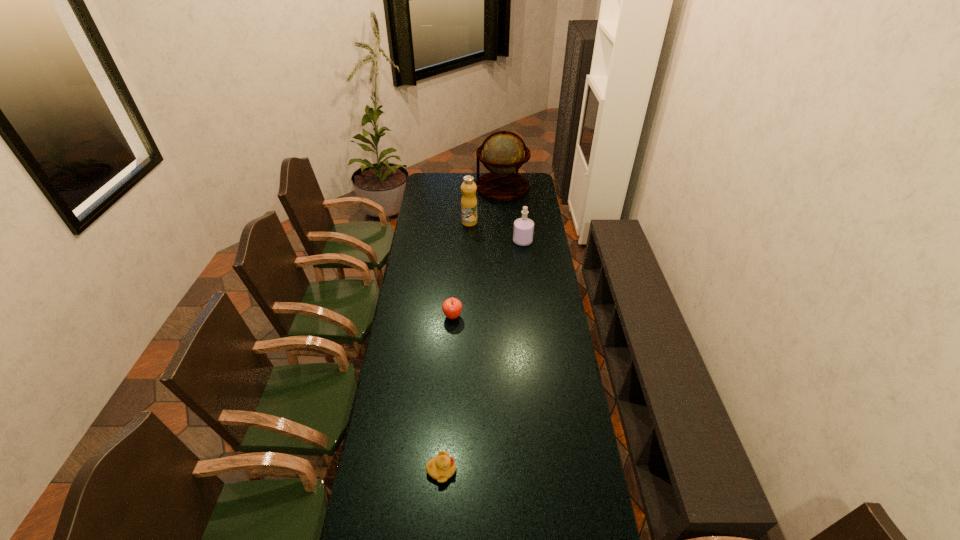
Where is `blank space located on the front-facing side of the globe`? The width and height of the screenshot is (960, 540). blank space located on the front-facing side of the globe is located at coordinates (441, 187).

In order to click on vacant space positioned on the front-facing side of the globe in this screenshot , I will do `click(429, 187)`.

Where is `vacant space located on the front-facing side of the globe`? The image size is (960, 540). vacant space located on the front-facing side of the globe is located at coordinates (450, 187).

At what (x,y) coordinates should I click in order to perform the action: click on vacant space positioned 0.380m on the front label of the fourth nearest object. Please return your answer as a coordinate pair (x, y). The height and width of the screenshot is (540, 960). Looking at the image, I should click on (545, 222).

You are a GUI agent. You are given a task and a screenshot of the screen. Output one action in this format:
    pyautogui.click(x=<x>, y=<y>)
    Task: Click on the vacant space located on the back of the third farthest object
    
    Given the screenshot: What is the action you would take?
    pyautogui.click(x=518, y=204)

I want to click on free space located 0.210m on the right of the apple, so pos(510,316).

This screenshot has width=960, height=540. Identify the location of vacant space positioned 0.290m at the beak of the duckling. (545, 470).

Where is `object that is at the far edge`? The height and width of the screenshot is (540, 960). object that is at the far edge is located at coordinates point(503,153).

Where is `globe that is at the right edge`? The width and height of the screenshot is (960, 540). globe that is at the right edge is located at coordinates (503, 153).

Where is `perfume present at the right edge`? perfume present at the right edge is located at coordinates (523, 227).